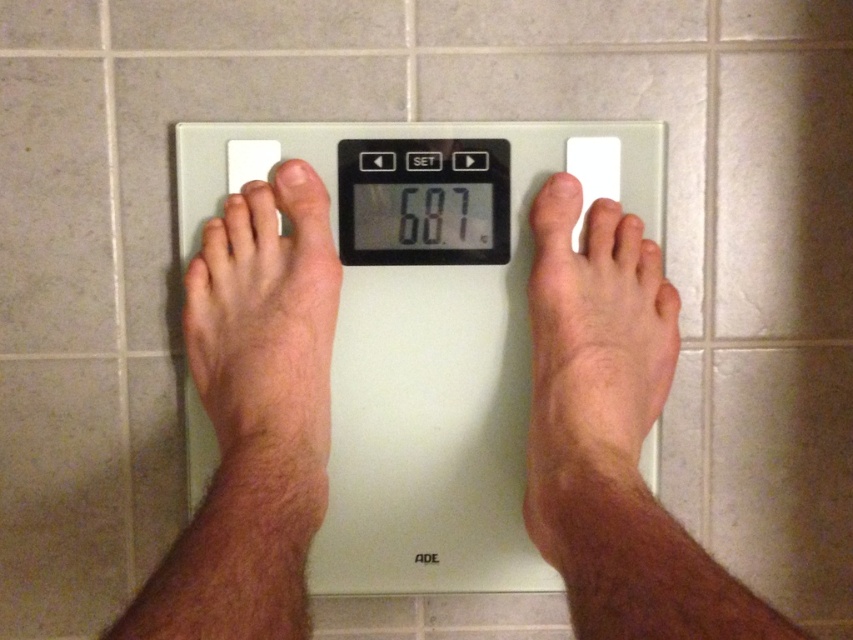
Question: Among these objects, which one is nearest to the camera?

Choices:
 (A) skinny white foot at right
 (B) white plastic scale at center

Answer: (A)

Question: Estimate the real-world distances between objects in this image. Which object is closer to the white plastic scale at center?

Choices:
 (A) skinny white foot at right
 (B) hair-covered skin at center

Answer: (B)

Question: Is skinny white foot at right positioned in front of hair-covered skin at center?

Choices:
 (A) yes
 (B) no

Answer: (A)

Question: Is white plastic scale at center to the right of skinny white foot at right from the viewer's perspective?

Choices:
 (A) yes
 (B) no

Answer: (B)

Question: Does skinny white foot at right appear on the left side of hair-covered skin at center?

Choices:
 (A) yes
 (B) no

Answer: (B)

Question: Based on their relative distances, which object is nearer to the hair-covered skin at center?

Choices:
 (A) skinny white foot at right
 (B) white plastic scale at center

Answer: (B)